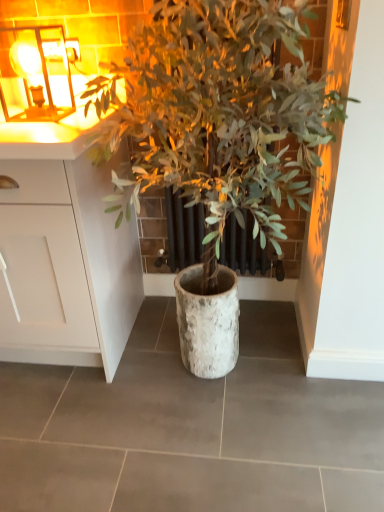
Question: Looking at the image, does metallic glass at upper left seem bigger or smaller compared to white matte cabinet at left?

Choices:
 (A) big
 (B) small

Answer: (B)

Question: Choose the correct answer: Is metallic glass at upper left inside white matte cabinet at left or outside it?

Choices:
 (A) outside
 (B) inside

Answer: (A)

Question: Estimate the real-world distances between objects in this image. Which object is farther from the green leafy plant at center?

Choices:
 (A) metallic glass at upper left
 (B) white matte cabinet at left

Answer: (A)

Question: Estimate the real-world distances between objects in this image. Which object is farther from the green leafy plant at center?

Choices:
 (A) metallic glass at upper left
 (B) white matte cabinet at left

Answer: (A)